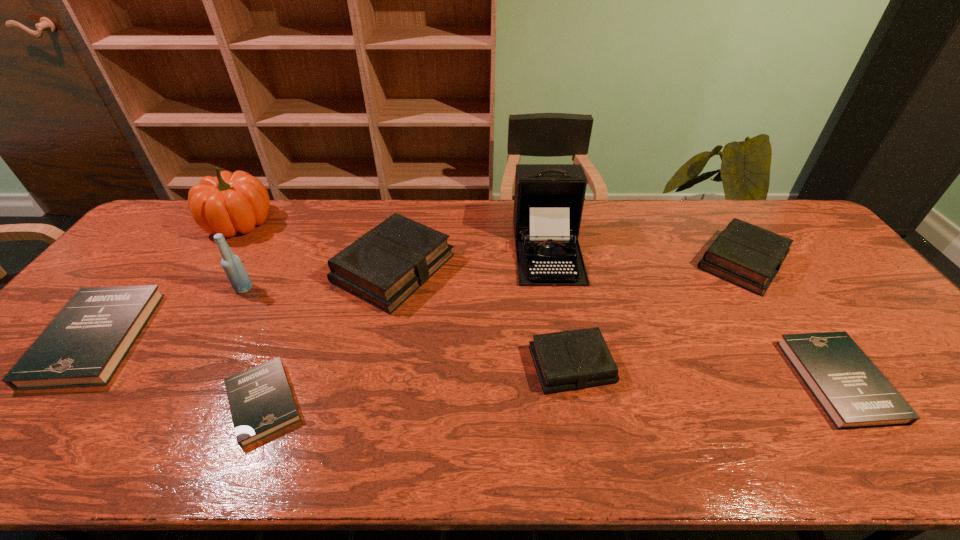
The image size is (960, 540). Find the location of `object positioned at the near right corner`. object positioned at the near right corner is located at coordinates (853, 392).

Where is `vacant space at the far edge of the desktop`? Image resolution: width=960 pixels, height=540 pixels. vacant space at the far edge of the desktop is located at coordinates (323, 207).

This screenshot has width=960, height=540. What are the coordinates of `vacant space at the near edge of the desktop` in the screenshot? It's located at (786, 442).

In the image, there is a desktop. Where is `blank space at the left edge`? This screenshot has width=960, height=540. blank space at the left edge is located at coordinates (137, 265).

At what (x,y) coordinates should I click in order to perform the action: click on vacant space at the right edge of the desktop. Please return your answer as a coordinate pair (x, y). This screenshot has height=540, width=960. Looking at the image, I should click on 900,340.

The width and height of the screenshot is (960, 540). Identify the location of empty location between the second biggest dark book and the second smallest greenish book. (790, 321).

Find the location of a particular element. This screenshot has width=960, height=540. blank region between the leftmost dark book and the shortest object is located at coordinates (180, 370).

You are a GUI agent. You are given a task and a screenshot of the screen. Output one action in this format:
    pyautogui.click(x=<x>, y=<y>)
    Task: Click on the free space between the pumpkin and the rightmost dark book
    
    Given the screenshot: What is the action you would take?
    pyautogui.click(x=539, y=302)

This screenshot has height=540, width=960. Find the location of `unoccupied position between the pumpkin and the second shortest book`. unoccupied position between the pumpkin and the second shortest book is located at coordinates (539, 302).

The width and height of the screenshot is (960, 540). In order to click on unoccupied position between the nearest greenish book and the second shortest book in this screenshot , I will do `click(705, 373)`.